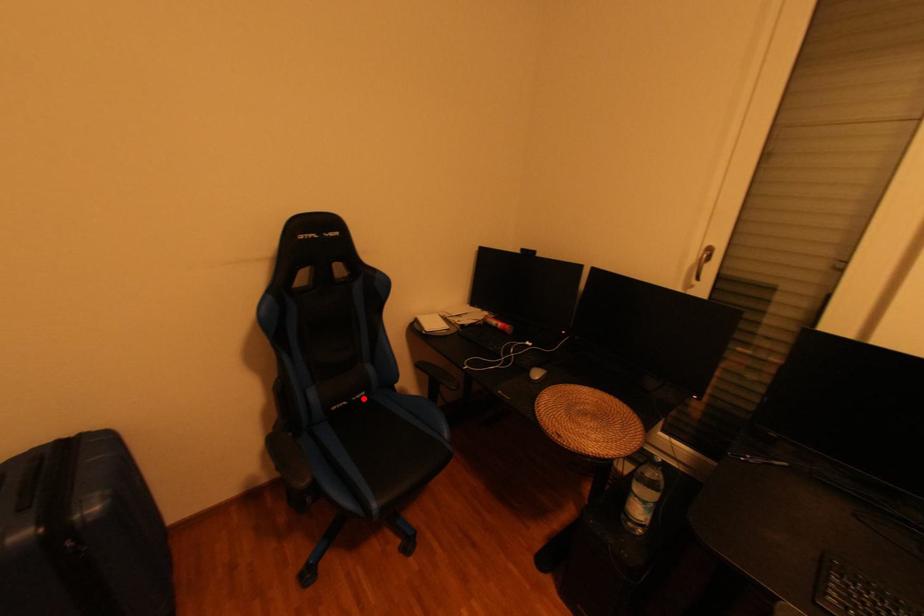
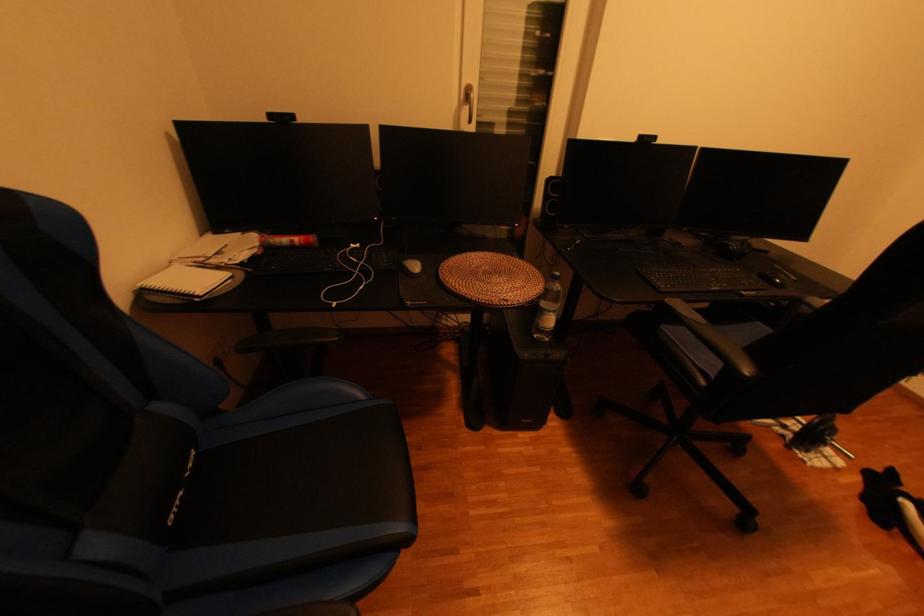
Where in the second image is the point corresponding to the highlighted location from the first image?

(197, 477)